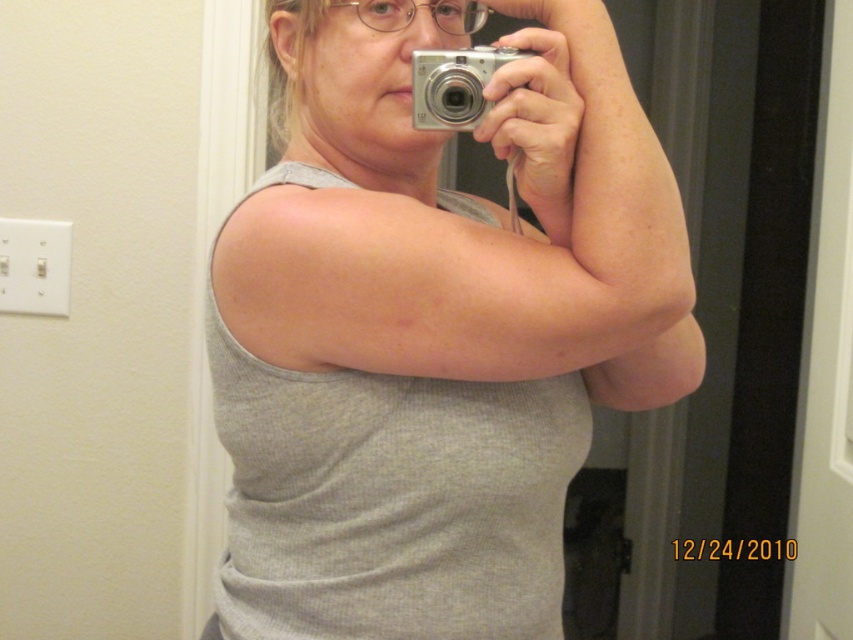
Does gray ribbed tank top at center appear over silver metallic camera at center?

Actually, gray ribbed tank top at center is below silver metallic camera at center.

Is gray ribbed tank top at center further to the viewer compared to silver metallic camera at center?

No, gray ribbed tank top at center is closer to the viewer.

Identify the location of gray ribbed tank top at center. (436, 330).

Find the location of a particular element. Image resolution: width=853 pixels, height=640 pixels. gray ribbed tank top at center is located at coordinates (436, 330).